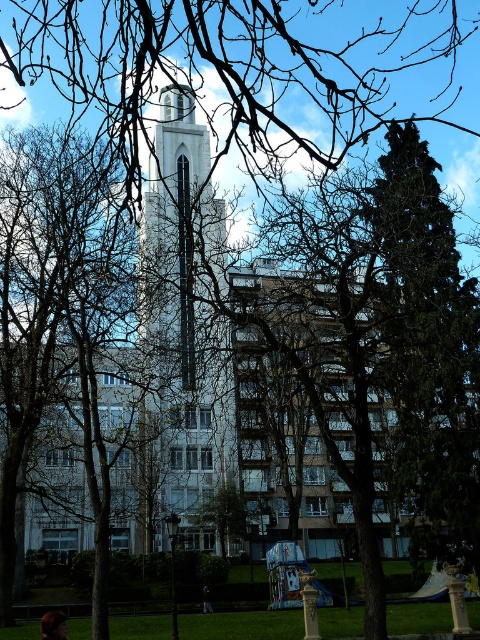
You are standing in front of the building and notice two points marked on the tower. The first point is at coordinates point (407, 241) and the second is at point (216, 241). Which point is closer to you?

Point (407, 241) is closer to the viewer than point (216, 241).

Based on the scene description, where is the green leafy tree at right located in terms of its 2D coordinates?

The green leafy tree at right is located at the 2D coordinates of point (428, 353).